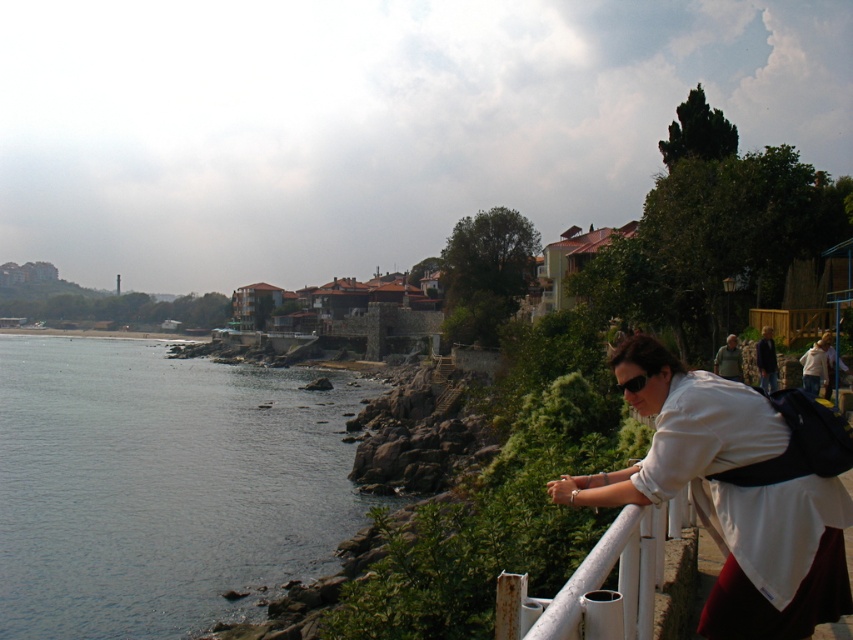
You are standing at the coastal view and see the white matte shirt at upper right and the white metallic rail at lower right. Which object is located more to the right side?

The white matte shirt at upper right is positioned on the right side of the white metallic rail at lower right, so it is more to the right.

You are standing at the coastal scene and want to know which object is higher between the white matte shirt at upper right and the white metallic rail at lower right. Can you determine this based on their positions?

The white matte shirt at upper right is taller than the white metallic rail at lower right according to their positions in the scene.

You are standing at the railing and want to look at the dark blue water at lower left. Which direction should you move relative to the white matte shirt at upper right?

The dark blue water at lower left is below the white matte shirt at upper right, so you should move downward from the white matte shirt at upper right to look at the dark blue water at lower left.